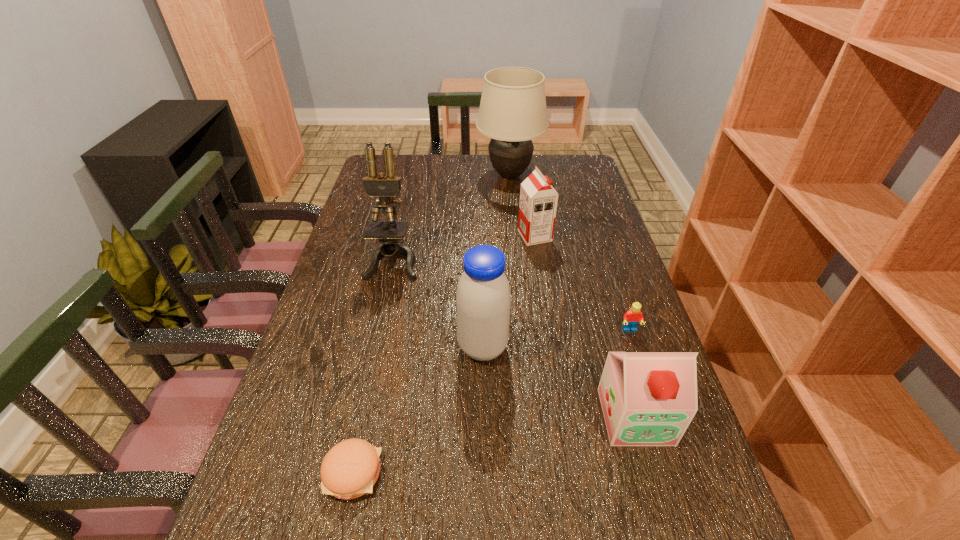
You are a GUI agent. You are given a task and a screenshot of the screen. Output one action in this format:
    pyautogui.click(x=<x>, y=<y>)
    Task: Click on the vacant position at the far edge of the desktop
    The width and height of the screenshot is (960, 540).
    Given the screenshot: What is the action you would take?
    tap(471, 167)

In order to click on vacant space at the right edge in this screenshot , I will do `click(588, 231)`.

The width and height of the screenshot is (960, 540). Identify the location of free space at the far left corner of the desktop. (396, 177).

In the image, there is a desktop. Where is `vacant space at the far right corner`? vacant space at the far right corner is located at coordinates tap(569, 169).

I want to click on vacant area that lies between the microscope and the lampshade, so click(452, 217).

I want to click on empty space that is in between the Lego and the tallest soya milk, so click(x=557, y=339).

In order to click on blank region between the rightmost soya milk and the farthest object in this screenshot , I will do `click(572, 296)`.

Image resolution: width=960 pixels, height=540 pixels. In order to click on free space between the patty and the rightmost soya milk in this screenshot , I will do `click(493, 444)`.

Where is `vacant space in between the microscope and the shortest object`? This screenshot has width=960, height=540. vacant space in between the microscope and the shortest object is located at coordinates (373, 366).

Locate an element on the screen. vacant space in between the nearest soya milk and the farthest object is located at coordinates (572, 296).